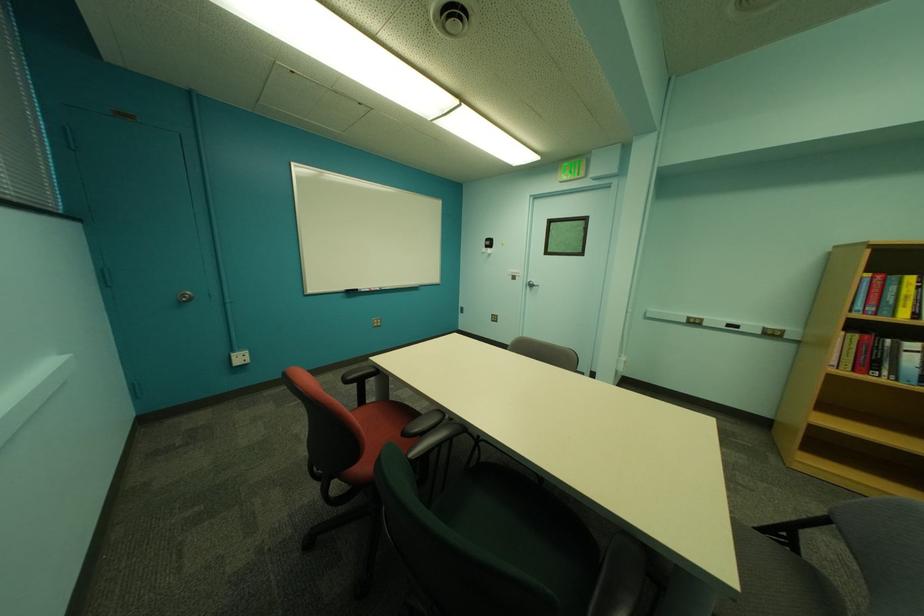
Where would you push the silver door handle? Please return your answer as a coordinate pair (x, y).

(185, 296)